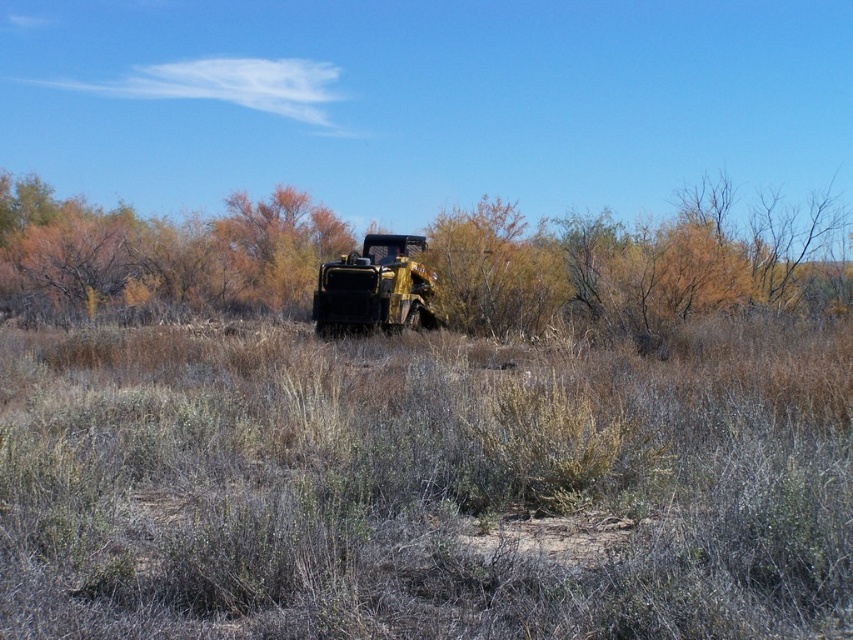
Who is taller, brown textured shrub at center or metallic yellow jeep at center?

Standing taller between the two is brown textured shrub at center.

Can you confirm if brown textured shrub at center is positioned to the left of metallic yellow jeep at center?

Indeed, brown textured shrub at center is positioned on the left side of metallic yellow jeep at center.

The image size is (853, 640). I want to click on brown textured shrub at center, so click(x=409, y=253).

Locate an element on the screen. This screenshot has height=640, width=853. brown textured shrub at center is located at coordinates (409, 253).

Is dry grass at center wider than brown textured shrub at center?

Incorrect, dry grass at center's width does not surpass brown textured shrub at center's.

Between point (538, 392) and point (715, 292), which one is positioned in front?

Point (538, 392) is in front.

This screenshot has width=853, height=640. What do you see at coordinates (424, 483) in the screenshot?
I see `dry grass at center` at bounding box center [424, 483].

Locate an element on the screen. The width and height of the screenshot is (853, 640). dry grass at center is located at coordinates [424, 483].

Is dry grass at center above metallic yellow jeep at center?

No, dry grass at center is not above metallic yellow jeep at center.

Is point (461, 429) less distant than point (332, 289)?

Yes, point (461, 429) is closer to viewer.

What do you see at coordinates (424, 483) in the screenshot? I see `dry grass at center` at bounding box center [424, 483].

Where is `dry grass at center`? Image resolution: width=853 pixels, height=640 pixels. dry grass at center is located at coordinates (424, 483).